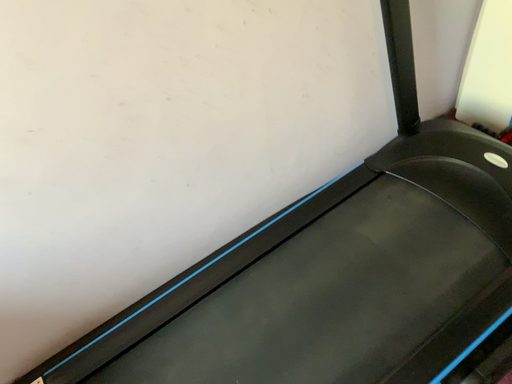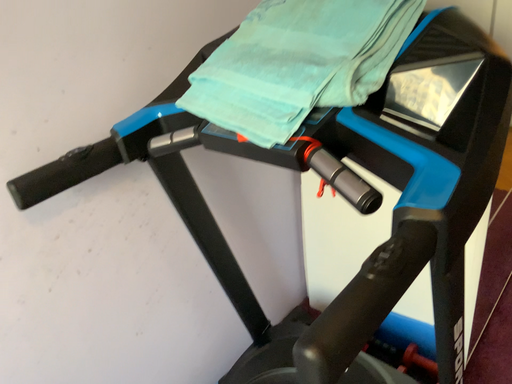
Question: Which way did the camera rotate in the video?

Choices:
 (A) rotated left
 (B) rotated right

Answer: (B)